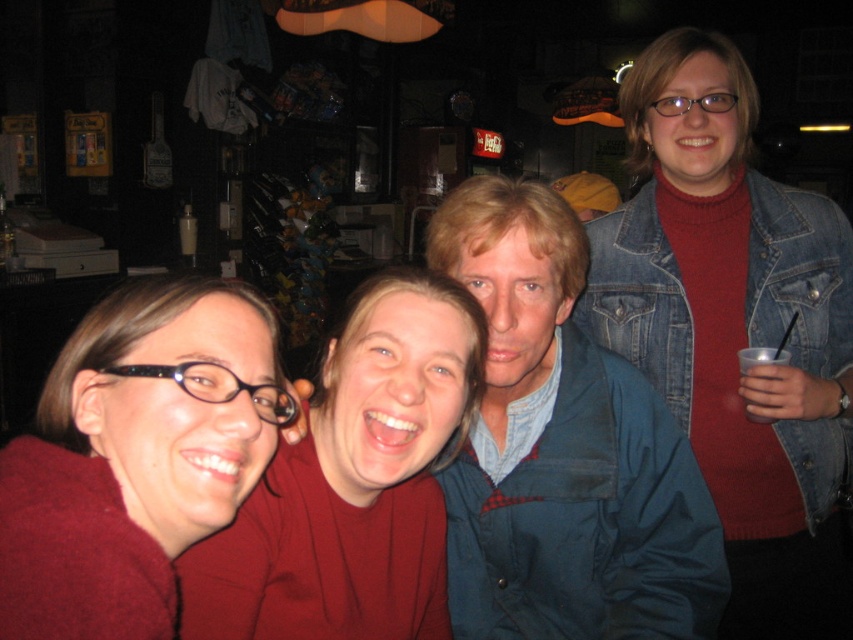
Question: Which point is farther to the camera?

Choices:
 (A) (514, 490)
 (B) (357, 481)
 (C) (172, 540)
 (D) (834, 561)

Answer: (D)

Question: Among these objects, which one is nearest to the camera?

Choices:
 (A) blue denim jacket at center
 (B) denim jacket at upper right
 (C) matte red shirt at center

Answer: (C)

Question: Which object appears farthest from the camera in this image?

Choices:
 (A) denim jacket at upper right
 (B) matte red sweater at lower left
 (C) matte red shirt at center
 (D) blue denim jacket at center

Answer: (A)

Question: Where is denim jacket at upper right located in relation to blue denim jacket at center in the image?

Choices:
 (A) below
 (B) above

Answer: (A)

Question: Does denim jacket at upper right appear over blue denim jacket at center?

Choices:
 (A) no
 (B) yes

Answer: (A)

Question: Is denim jacket at upper right closer to camera compared to blue denim jacket at center?

Choices:
 (A) yes
 (B) no

Answer: (B)